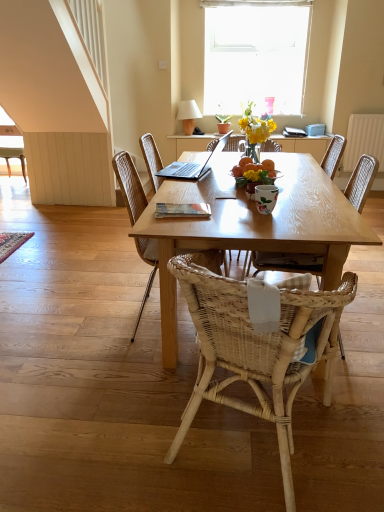
This screenshot has height=512, width=384. I want to click on free space between woven wood chair at center, which appears as the fourth chair when viewed from the back, and wooden table at center, so click(186, 400).